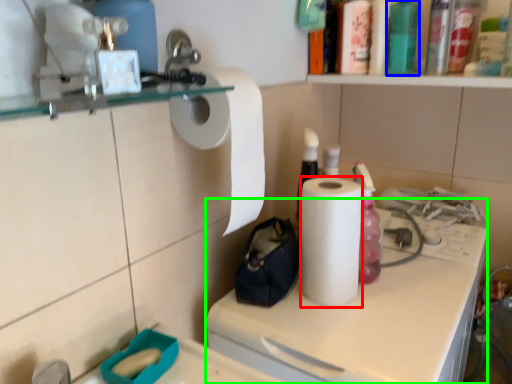
Question: Which object is positioned farthest from paper towel (highlighted by a red box)? Select from bottle (highlighted by a blue box) and counter (highlighted by a green box).

Choices:
 (A) bottle
 (B) counter

Answer: (A)